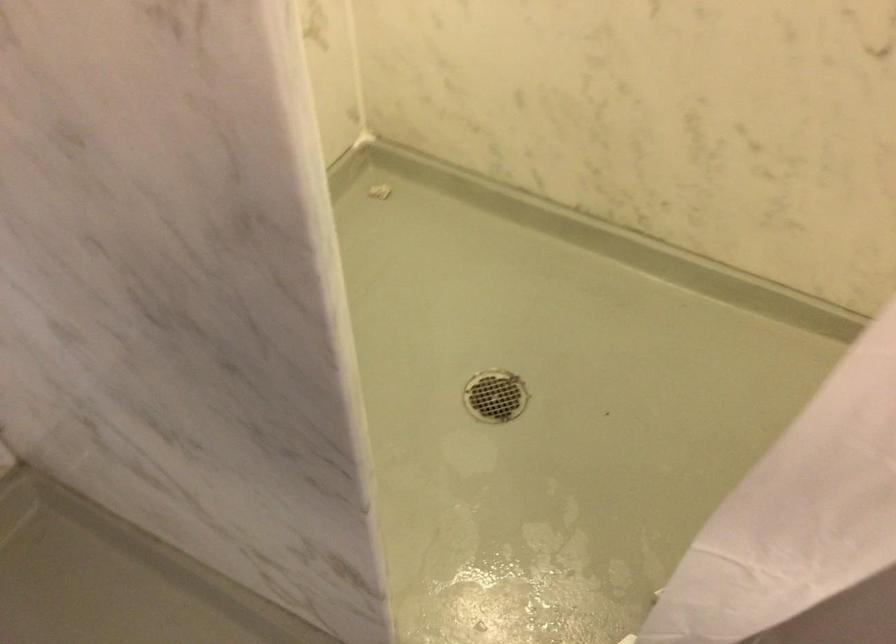
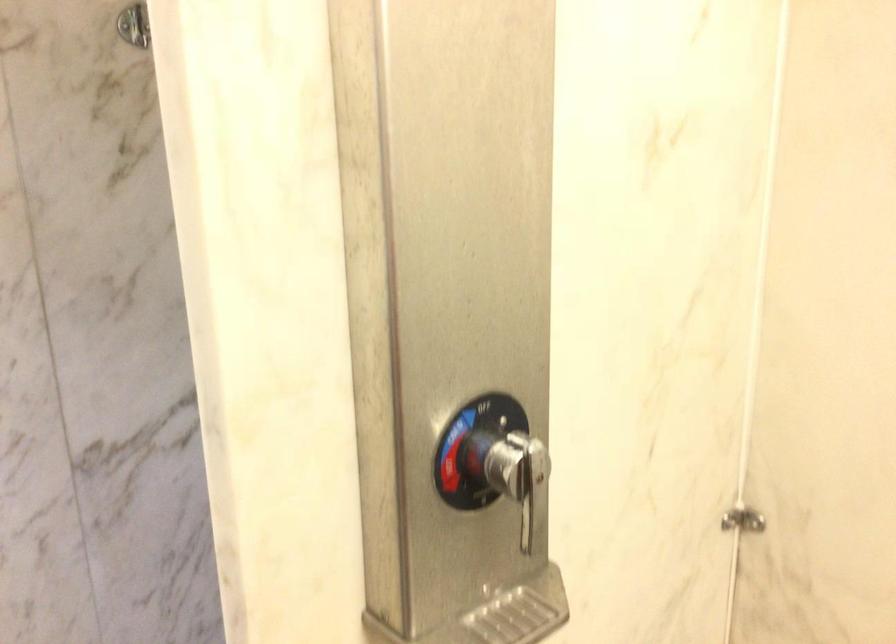
The images are taken continuously from a first-person perspective. In which direction is your viewpoint rotating?

The camera's rotation is toward left-down.